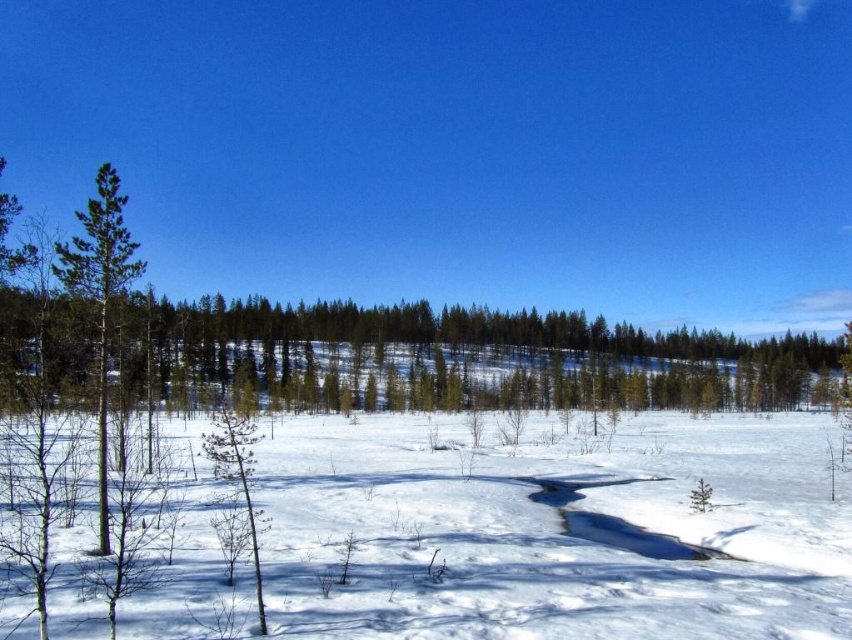
Is white powdery snow at center bigger than green matte tree at lower left?

Actually, white powdery snow at center might be smaller than green matte tree at lower left.

You are a GUI agent. You are given a task and a screenshot of the screen. Output one action in this format:
    pyautogui.click(x=<x>, y=<y>)
    Task: Click on the white powdery snow at center
    
    Given the screenshot: What is the action you would take?
    pyautogui.click(x=556, y=531)

Image resolution: width=852 pixels, height=640 pixels. In order to click on white powdery snow at center in this screenshot , I will do `click(556, 531)`.

Which is more to the right, white powdery snow at center or green matte tree at left?

Positioned to the right is white powdery snow at center.

Can you confirm if white powdery snow at center is positioned below green matte tree at left?

Indeed, white powdery snow at center is positioned under green matte tree at left.

What do you see at coordinates (556, 531) in the screenshot?
I see `white powdery snow at center` at bounding box center [556, 531].

You are a GUI agent. You are given a task and a screenshot of the screen. Output one action in this format:
    pyautogui.click(x=<x>, y=<y>)
    Task: Click on the white powdery snow at center
    
    Given the screenshot: What is the action you would take?
    pyautogui.click(x=556, y=531)

Is green matte tree at left thinner than green matte tree at lower left?

Indeed, green matte tree at left has a lesser width compared to green matte tree at lower left.

Image resolution: width=852 pixels, height=640 pixels. I want to click on green matte tree at left, so click(x=101, y=292).

The height and width of the screenshot is (640, 852). What are the coordinates of `green matte tree at left` in the screenshot? It's located at (101, 292).